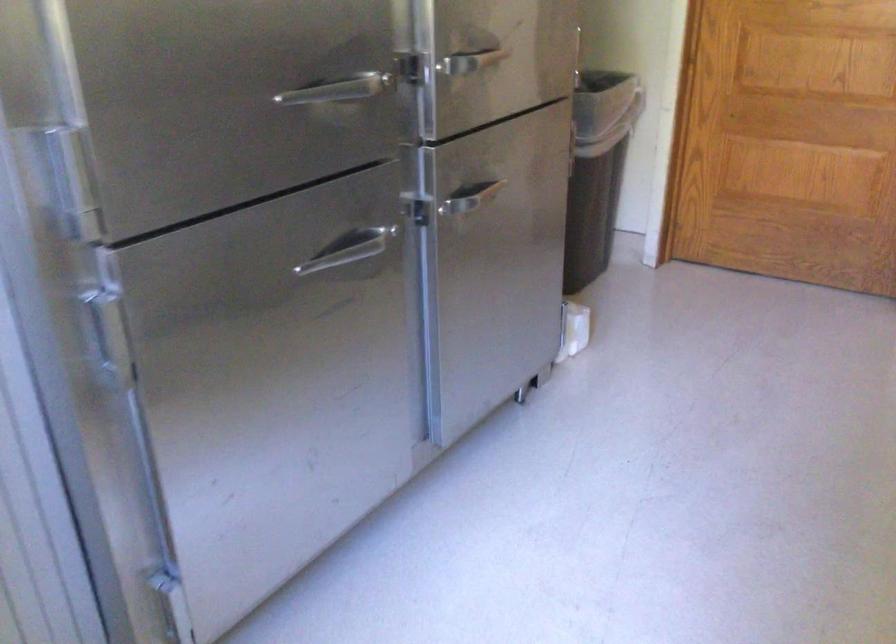
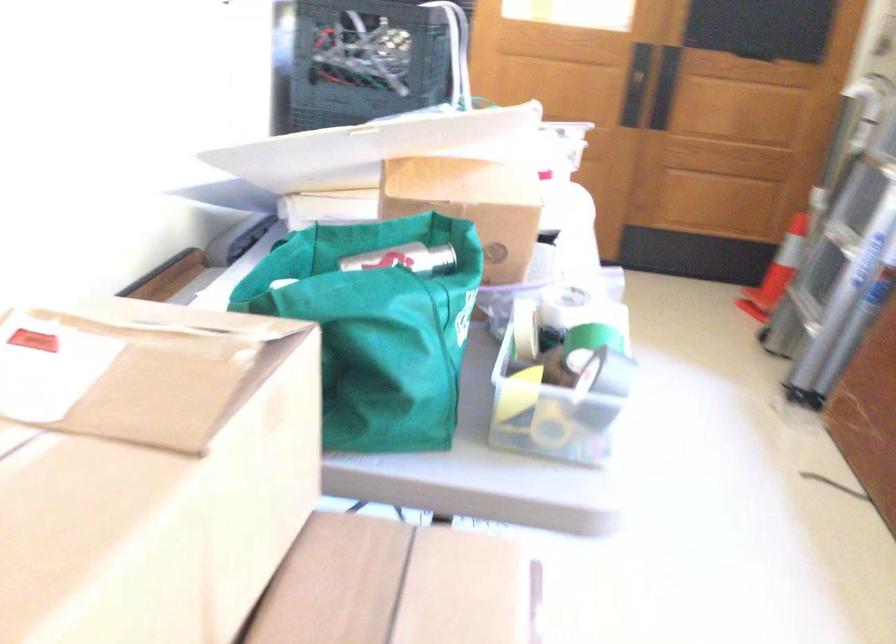
Based on the continuous images, in which direction is the camera rotating?

The camera rotated toward right-down.